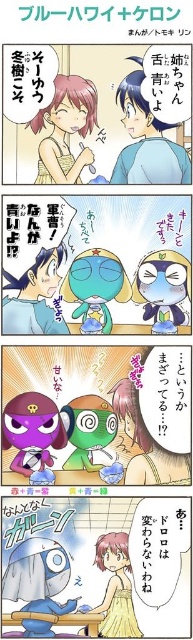
Between matte pink hair at upper left and matte yellow dress at lower center, which one appears on the right side from the viewer's perspective?

matte yellow dress at lower center is more to the right.

Can you confirm if matte pink hair at upper left is positioned above matte yellow dress at lower center?

Yes.

Describe the element at coordinates (66, 129) in the screenshot. I see `matte pink hair at upper left` at that location.

This screenshot has width=193, height=640. In order to click on matte pink hair at upper left in this screenshot , I will do `click(66, 129)`.